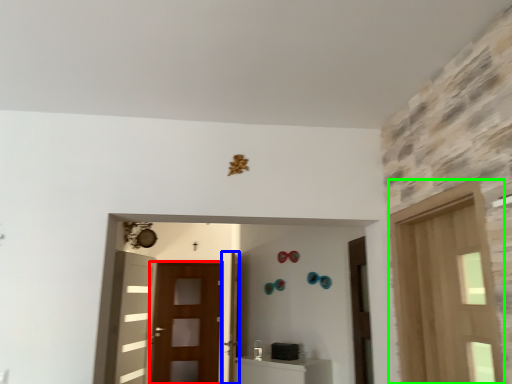
Question: Which object is positioned closest to screen door (highlighted by a red box)? Select from door (highlighted by a blue box) and door (highlighted by a green box).

Choices:
 (A) door
 (B) door

Answer: (A)